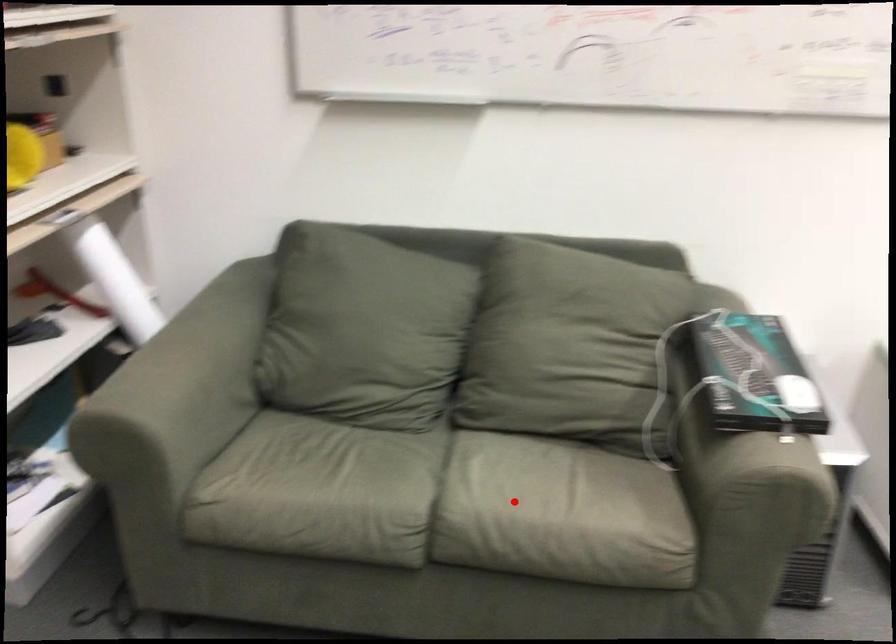
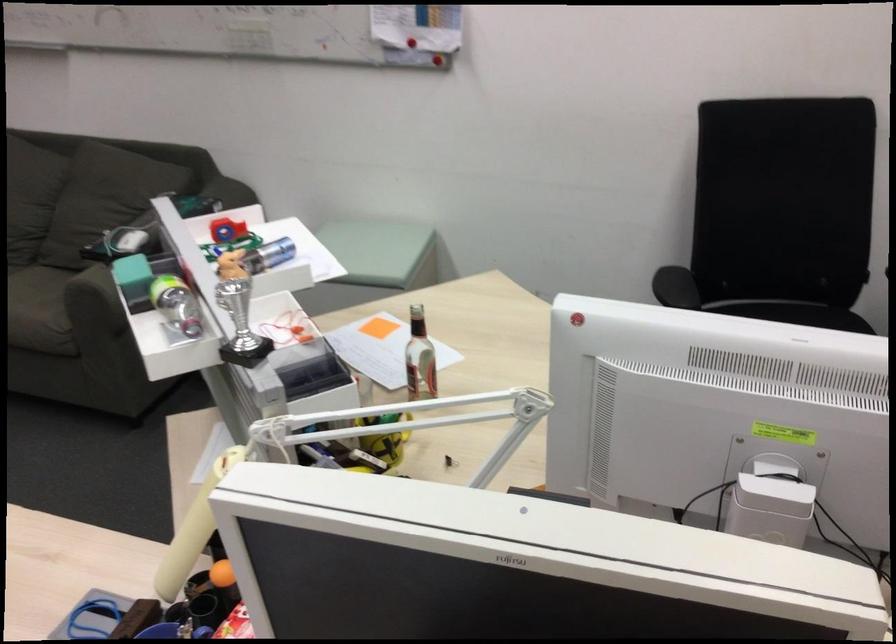
Find the pixel in the second image that matches the highlighted location in the first image.

(39, 308)